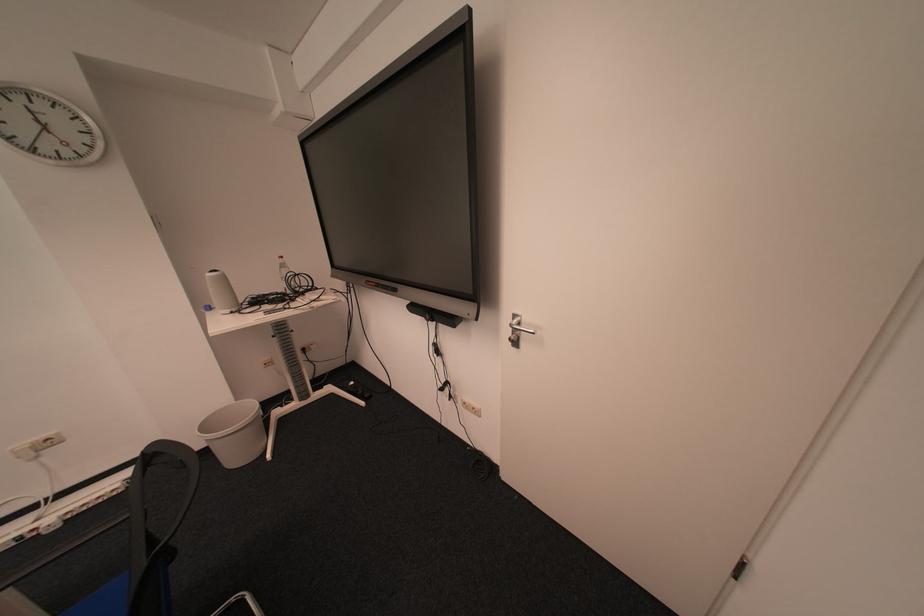
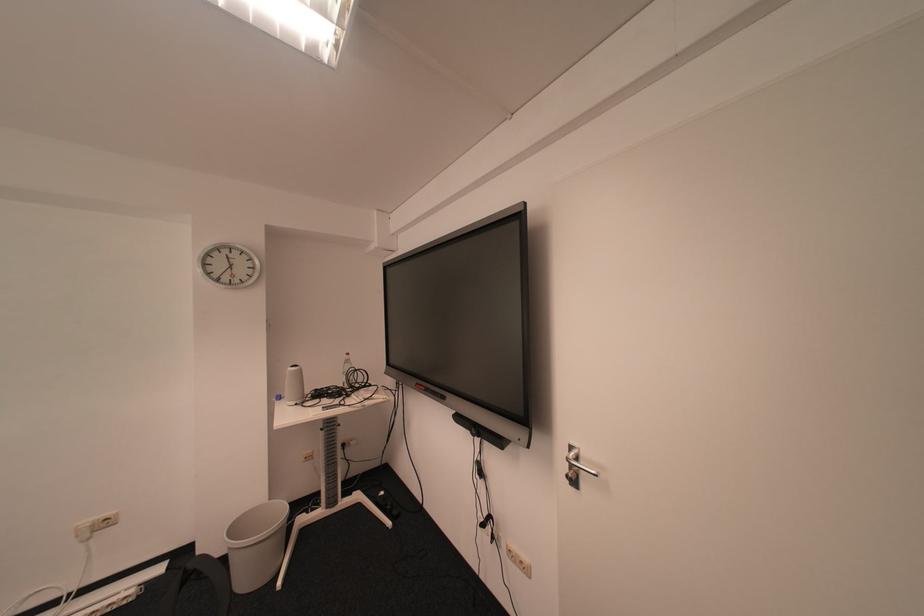
Question: Based on the continuous images, in which direction is the camera rotating? Reply with the corresponding letter.

Choices:
 (A) Left
 (B) Right
 (C) Up
 (D) Down

Answer: (C)